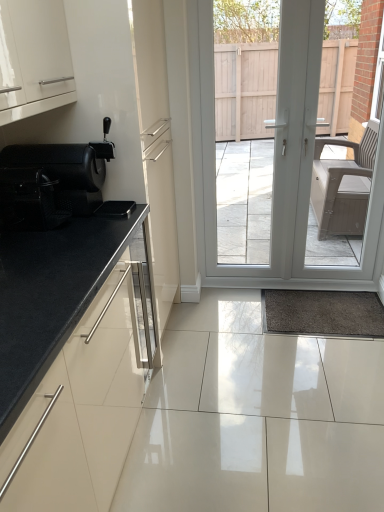
This screenshot has height=512, width=384. Describe the element at coordinates (283, 162) in the screenshot. I see `white glossy door at center` at that location.

Describe the element at coordinates (49, 183) in the screenshot. I see `black mesh chair at left` at that location.

I want to click on white glossy door at center, so click(283, 162).

Considering the relative positions of black mesh chair at left and black granite countertop at left in the image provided, is black mesh chair at left to the left of black granite countertop at left from the viewer's perspective?

Indeed, black mesh chair at left is positioned on the left side of black granite countertop at left.

How many degrees apart are the facing directions of black mesh chair at left and black granite countertop at left?

black mesh chair at left and black granite countertop at left are facing 2.79 degrees away from each other.

From a real-world perspective, is black mesh chair at left positioned over black granite countertop at left based on gravity?

Yes.

Between black mesh chair at left and black granite countertop at left, which one has smaller width?

black mesh chair at left is thinner.

Can you confirm if black granite countertop at left is positioned to the right of black mesh chair at left?

Correct, you'll find black granite countertop at left to the right of black mesh chair at left.

Which object is thinner, black granite countertop at left or black mesh chair at left?

black mesh chair at left.

Considering the sizes of objects black granite countertop at left and black mesh chair at left in the image provided, who is shorter, black granite countertop at left or black mesh chair at left?

With less height is black mesh chair at left.

The image size is (384, 512). Find the location of `countertop on the right of black mesh chair at left`. countertop on the right of black mesh chair at left is located at coordinates (49, 297).

From a real-world perspective, is white glossy door at center above or below black mesh chair at left?

white glossy door at center is situated lower than black mesh chair at left in the real world.

Does white glossy door at center turn towards black mesh chair at left?

No, white glossy door at center does not turn towards black mesh chair at left.

Measure the distance between white glossy door at center and black mesh chair at left.

They are 1.24 meters apart.

Is white glossy door at center far from black mesh chair at left?

Indeed, white glossy door at center is not near black mesh chair at left.

Identify the location of door above the black granite countertop at left (from a real-world perspective). (283, 162).

Can you confirm if white glossy door at center is positioned to the right of black granite countertop at left?

Yes.

Which point is more forward, (301, 100) or (38, 321)?

Point (38, 321)

How different are the orientations of white glossy door at center and black granite countertop at left in degrees?

There is a 87.6-degree angle between the facing directions of white glossy door at center and black granite countertop at left.

Is black granite countertop at left next to white glossy door at center?

There is a gap between black granite countertop at left and white glossy door at center.

Consider the image. Considering the relative positions of black granite countertop at left and white glossy door at center in the image provided, is black granite countertop at left in front of white glossy door at center?

Yes, black granite countertop at left is in front of white glossy door at center.

What's the angular difference between black granite countertop at left and white glossy door at center's facing directions?

The angular difference between black granite countertop at left and white glossy door at center is 87.6 degrees.

Is black granite countertop at left inside the boundaries of white glossy door at center, or outside?

black granite countertop at left is outside white glossy door at center.

Considering the relative positions of black mesh chair at left and white glossy door at center in the image provided, is black mesh chair at left to the left or to the right of white glossy door at center?

Clearly, black mesh chair at left is on the left of white glossy door at center in the image.

Between point (26, 178) and point (209, 5), which one is positioned behind?

Point (209, 5)

Considering their positions, is black mesh chair at left located in front of or behind white glossy door at center?

Visually, black mesh chair at left is located in front of white glossy door at center.

Where is `countertop behind the black mesh chair at left`? The width and height of the screenshot is (384, 512). countertop behind the black mesh chair at left is located at coordinates pos(49,297).

In the image, there is a black mesh chair at left. What are the coordinates of `countertop below it (from the image's perspective)` in the screenshot? It's located at (49, 297).

Looking at the image, which one is located closer to black mesh chair at left, white glossy door at center or black granite countertop at left?

The object closer to black mesh chair at left is black granite countertop at left.

Based on their spatial positions, is black mesh chair at left or black granite countertop at left further from white glossy door at center?

black granite countertop at left is positioned further to the anchor white glossy door at center.

From the image, which object appears to be nearer to black granite countertop at left, black mesh chair at left or white glossy door at center?

black mesh chair at left lies closer to black granite countertop at left than the other object.

Estimate the real-world distances between objects in this image. Which object is further from white glossy door at center, black granite countertop at left or black mesh chair at left?

Based on the image, black granite countertop at left appears to be further to white glossy door at center.

Estimate the real-world distances between objects in this image. Which object is further from black granite countertop at left, white glossy door at center or black mesh chair at left?

white glossy door at center is positioned further to the anchor black granite countertop at left.

Estimate the real-world distances between objects in this image. Which object is further from black mesh chair at left, black granite countertop at left or white glossy door at center?

white glossy door at center is positioned further to the anchor black mesh chair at left.

This screenshot has height=512, width=384. I want to click on countertop between black mesh chair at left and white glossy door at center, so click(49, 297).